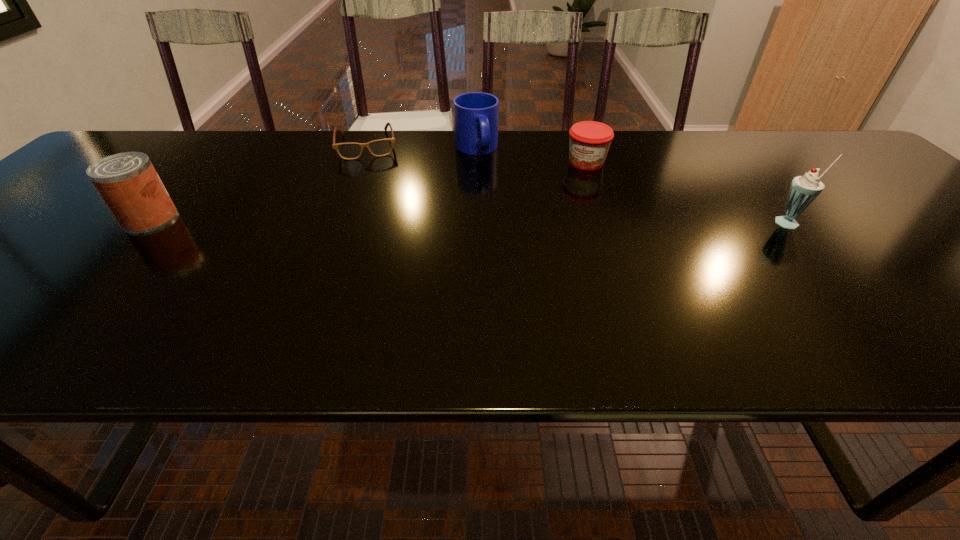
At what (x,y) coordinates should I click in order to perform the action: click on free space between the leftmost object and the shortest object. Please return your answer as a coordinate pair (x, y). The image size is (960, 540). Looking at the image, I should click on (259, 182).

Locate an element on the screen. This screenshot has width=960, height=540. free spot between the leftmost object and the rightmost object is located at coordinates (470, 221).

Where is `vacant area that lies between the jam and the can`? vacant area that lies between the jam and the can is located at coordinates (369, 191).

The width and height of the screenshot is (960, 540). Find the location of `free spot between the second object from right to left and the milkshake`. free spot between the second object from right to left and the milkshake is located at coordinates (688, 193).

Identify the location of object that stands as the closest to the milkshake. The width and height of the screenshot is (960, 540). (589, 140).

Locate an element on the screen. The height and width of the screenshot is (540, 960). the third closest object to the spectacles is located at coordinates (589, 140).

Locate an element on the screen. This screenshot has height=540, width=960. vacant area in the image that satisfies the following two spatial constraints: 1. on the front side of the mug; 2. on the right side of the second shortest object is located at coordinates (476, 163).